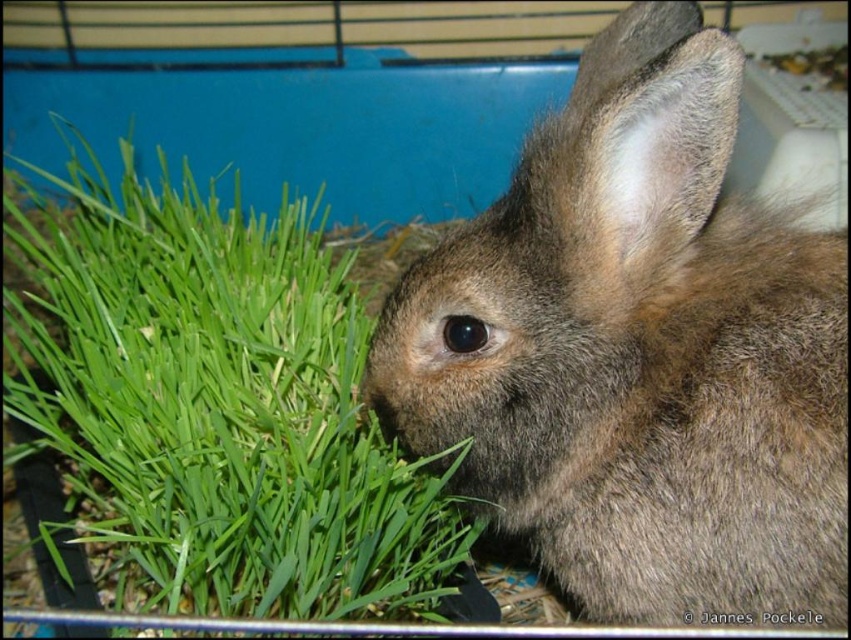
You are a pet owner observing your rabbit in its enclosure. You notice the brown furry rabbit at center and the green leafy grass at left. Which object is closer to you from your viewing position?

The brown furry rabbit at center is closer to you because it is in front of the green leafy grass at left.

You are a pet owner who wants to ensure the brown furry rabbit at center has enough space to move around its enclosure. Based on the image, does the rabbit have enough vertical space considering its height compared to the green leafy grass at left?

The brown furry rabbit at center is not as tall as the green leafy grass at left, so the rabbit likely has enough vertical space in its enclosure to move around without any issues.